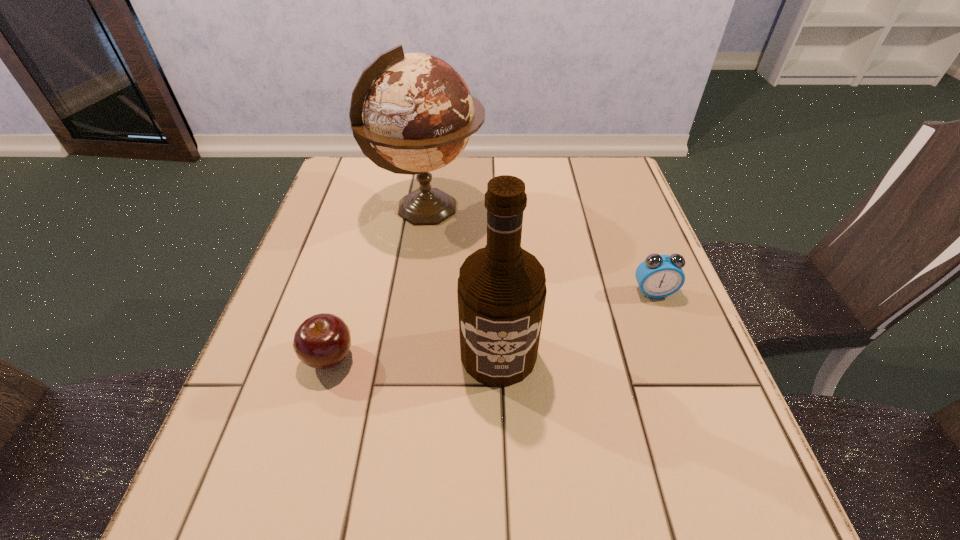
Identify the location of globe that is at the left edge. This screenshot has height=540, width=960. [416, 110].

Where is `apple positioned at the left edge`? This screenshot has width=960, height=540. apple positioned at the left edge is located at coordinates (322, 341).

This screenshot has height=540, width=960. What are the coordinates of `object located at the right edge` in the screenshot? It's located at (658, 276).

Find the location of a particular element. object that is at the far left corner is located at coordinates (416, 110).

You are a GUI agent. You are given a task and a screenshot of the screen. Output one action in this format:
    pyautogui.click(x=<x>, y=<y>)
    Task: Click on the blank space at the far edge of the desktop
    This screenshot has height=540, width=960.
    Given the screenshot: What is the action you would take?
    [x=455, y=179]

The image size is (960, 540). I want to click on free point at the near edge, so click(x=513, y=488).

Find the location of a particular element. This screenshot has height=540, width=960. blank space at the left edge of the desktop is located at coordinates (351, 220).

The height and width of the screenshot is (540, 960). In order to click on vacant position at the right edge of the desktop in this screenshot , I will do `click(616, 284)`.

You are a GUI agent. You are given a task and a screenshot of the screen. Output one action in this format:
    pyautogui.click(x=<x>, y=<y>)
    Task: Click on the vacant region at the near left corner of the desktop
    
    Given the screenshot: What is the action you would take?
    pyautogui.click(x=232, y=517)

Identify the location of free region at the far right corner. (576, 190).